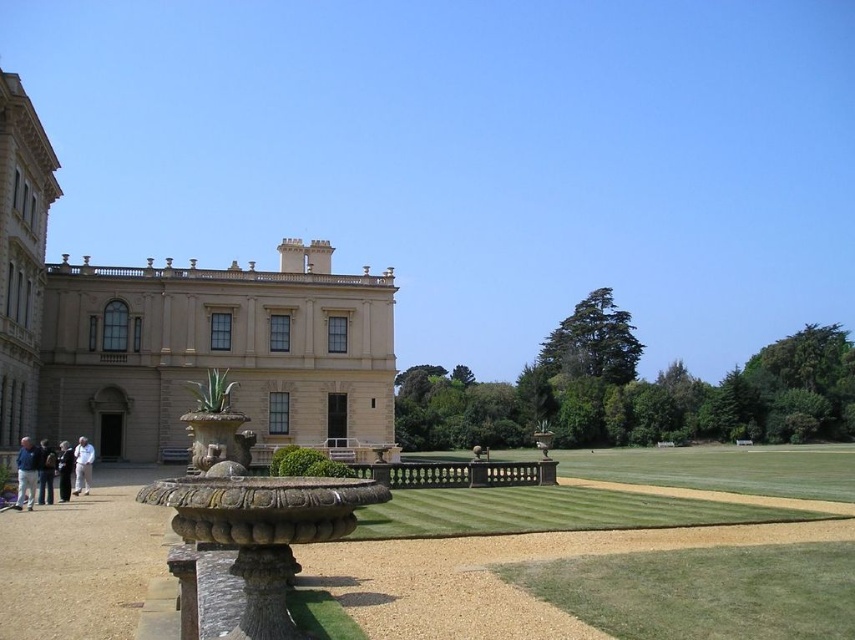
Question: Can you confirm if dark blue jeans at lower left is positioned below white cotton shirt at lower left?

Choices:
 (A) yes
 (B) no

Answer: (B)

Question: Which object is the closest to the light blue denim jacket at lower left?

Choices:
 (A) beige stone palace at left
 (B) dark blue jeans at lower left
 (C) stone fountain at center

Answer: (B)

Question: Which point is closer to the camera?

Choices:
 (A) (52, 468)
 (B) (75, 484)
 (C) (31, 493)

Answer: (C)

Question: Which point is farther from the camera taking this photo?

Choices:
 (A) (25, 472)
 (B) (69, 465)
 (C) (220, 518)

Answer: (B)

Question: Is stone fountain at center above white cotton shirt at lower left?

Choices:
 (A) yes
 (B) no

Answer: (A)

Question: Is beige stone palace at left to the right of stone fountain at center from the viewer's perspective?

Choices:
 (A) yes
 (B) no

Answer: (B)